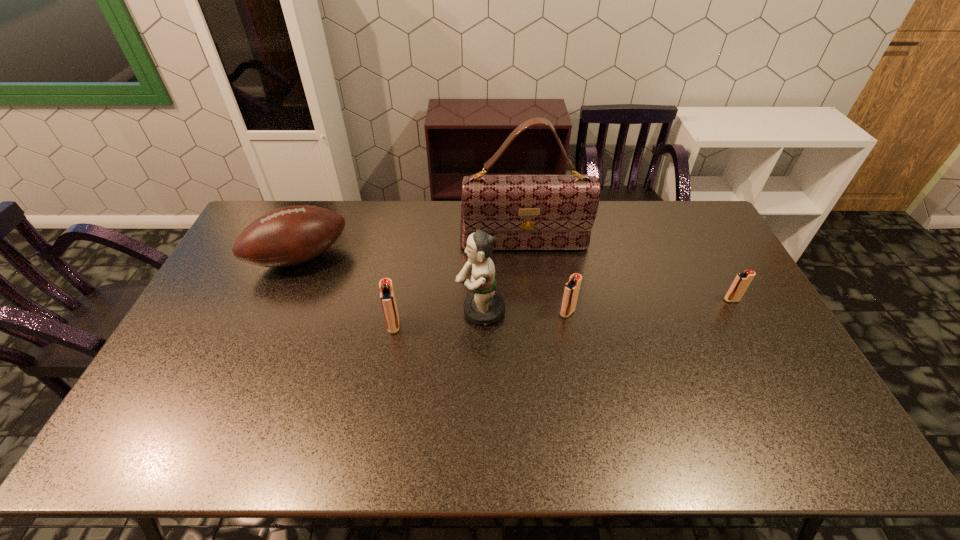
At what (x,y) coordinates should I click in order to perform the action: click on object present at the far left corner. Please return your answer as a coordinate pair (x, y). Looking at the image, I should click on (288, 236).

At what (x,y) coordinates should I click in order to perform the action: click on vacant space at the far edge. Please return your answer as a coordinate pair (x, y). This screenshot has height=540, width=960. Looking at the image, I should click on (610, 207).

You are a GUI agent. You are given a task and a screenshot of the screen. Output one action in this format:
    pyautogui.click(x=<x>, y=<y>)
    Task: Click on the free space at the near edge
    Image resolution: width=960 pixels, height=540 pixels.
    Given the screenshot: What is the action you would take?
    pyautogui.click(x=328, y=409)

The width and height of the screenshot is (960, 540). In the image, there is a desktop. What are the coordinates of `vacant space at the left edge` in the screenshot? It's located at (204, 339).

I want to click on free region at the right edge, so click(712, 298).

Locate an element on the screen. This screenshot has width=960, height=540. free point between the rightmost igniter and the second shortest igniter is located at coordinates (649, 306).

At what (x,y) coordinates should I click in order to perform the action: click on vacant area that lies between the second tallest igniter and the tallest object. Please return your answer as a coordinate pair (x, y). The image size is (960, 540). Looking at the image, I should click on (545, 279).

The height and width of the screenshot is (540, 960). In order to click on vacant region between the leftmost object and the handbag in this screenshot , I will do `click(412, 252)`.

Identify the location of unoccupied position between the leftmost igniter and the handbag. (459, 286).

Image resolution: width=960 pixels, height=540 pixels. What are the coordinates of `unoccupied position between the figurine and the farthest igniter` in the screenshot? It's located at (606, 305).